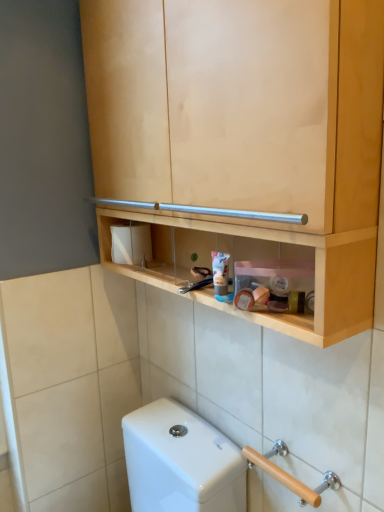
What is the approximate width of white matte toilet paper at center?

4.34 inches.

Describe the element at coordinates (220, 272) in the screenshot. The height and width of the screenshot is (512, 384). I see `white glossy toothpaste at center` at that location.

I want to click on white glossy toothpaste at center, so click(220, 272).

This screenshot has width=384, height=512. Identify the location of natural wood cabinet at upper center. (243, 137).

Locate an element on the screen. wooden at lower right is located at coordinates (289, 474).

Does point (315, 502) come farther from viewer compared to point (348, 104)?

Yes, point (315, 502) is farther from viewer.

Is wooden at lower right at the left side of natural wood cabinet at upper center?

No.

What's the angular difference between wooden at lower right and natural wood cabinet at upper center's facing directions?

The angular difference between wooden at lower right and natural wood cabinet at upper center is 0.347 degrees.

Is wooden at lower right turned away from natural wood cabinet at upper center?

No, wooden at lower right is not facing the opposite direction of natural wood cabinet at upper center.

Is wooden at lower right not close to white matte toilet paper at center?

No, wooden at lower right is not far from white matte toilet paper at center.

Where is `door handle lying in front of the white matte toilet paper at center`? door handle lying in front of the white matte toilet paper at center is located at coordinates (289, 474).

Would you say wooden at lower right is to the left or to the right of white matte toilet paper at center in the picture?

Result: Based on their positions, wooden at lower right is located to the right of white matte toilet paper at center.

How distant is wooden at lower right from white matte toilet paper at center?

wooden at lower right and white matte toilet paper at center are 24.22 inches apart from each other.

From a real-world perspective, is white matte toilet paper at center located beneath natural wood cabinet at upper center?

Yes, from a real-world perspective, white matte toilet paper at center is below natural wood cabinet at upper center.

Is white matte toilet paper at center not near natural wood cabinet at upper center?

That's not correct — white matte toilet paper at center is a little close to natural wood cabinet at upper center.

Considering the positions of point (136, 262) and point (99, 131), is point (136, 262) closer or farther from the camera than point (99, 131)?

Point (136, 262) appears to be farther away from the viewer than point (99, 131).

Between point (130, 244) and point (218, 275), which one is positioned behind?

Point (130, 244)

From the image's perspective, is white matte toilet paper at center positioned above or below white glossy toothpaste at center?

white matte toilet paper at center is situated higher than white glossy toothpaste at center in the image.

Does white matte toilet paper at center come behind white glossy toothpaste at center?

That is True.

Who is taller, white matte toilet paper at center or white glossy toothpaste at center?

white matte toilet paper at center.

Could you tell me if wooden at lower right is turned towards white glossy toothpaste at center?

No, wooden at lower right does not turn towards white glossy toothpaste at center.

Does wooden at lower right have a lesser height compared to white glossy toothpaste at center?

Indeed, wooden at lower right has a lesser height compared to white glossy toothpaste at center.

From a real-world perspective, which is physically below, wooden at lower right or white glossy toothpaste at center?

From a 3D spatial view, wooden at lower right is below.

Considering the positions of point (343, 42) and point (132, 234), is point (343, 42) closer or farther from the camera than point (132, 234)?

Point (343, 42).

What are the coordinates of `toilet paper below the natural wood cabinet at upper center (from the image's perspective)` in the screenshot? It's located at (131, 244).

Is white matte toilet paper at center located within natural wood cabinet at upper center?

Yes, white matte toilet paper at center is inside natural wood cabinet at upper center.

You are a GUI agent. You are given a task and a screenshot of the screen. Output one action in this format:
    pyautogui.click(x=<x>, y=<y>)
    Task: Click on the toothpaste below the white matte toilet paper at center (from a real-world perspective)
    
    Given the screenshot: What is the action you would take?
    pyautogui.click(x=220, y=272)

Is white glossy toothpaste at center thinner than white matte toilet paper at center?

Indeed, white glossy toothpaste at center has a lesser width compared to white matte toilet paper at center.

How many degrees apart are the facing directions of white glossy toothpaste at center and white matte toilet paper at center?

The angle between the facing direction of white glossy toothpaste at center and the facing direction of white matte toilet paper at center is 0.00278 degrees.

Where is `cabinetry located in front of the wooden at lower right`? The height and width of the screenshot is (512, 384). cabinetry located in front of the wooden at lower right is located at coordinates (243, 137).

The image size is (384, 512). I want to click on toilet paper behind the wooden at lower right, so click(131, 244).

Which object lies further to the anchor point wooden at lower right, natural wood cabinet at upper center or white glossy toothpaste at center?

natural wood cabinet at upper center is positioned further to the anchor wooden at lower right.

When comparing their distances from white matte toilet paper at center, does natural wood cabinet at upper center or wooden at lower right seem further?

wooden at lower right is further to white matte toilet paper at center.

Estimate the real-world distances between objects in this image. Which object is further from wooden at lower right, natural wood cabinet at upper center or white matte toilet paper at center?

natural wood cabinet at upper center.

In the scene shown: Estimate the real-world distances between objects in this image. Which object is closer to white matte toilet paper at center, wooden at lower right or natural wood cabinet at upper center?

The object closer to white matte toilet paper at center is natural wood cabinet at upper center.

Estimate the real-world distances between objects in this image. Which object is closer to white glossy toothpaste at center, white matte toilet paper at center or wooden at lower right?

white matte toilet paper at center lies closer to white glossy toothpaste at center than the other object.

Looking at the image, which one is located closer to white glossy toothpaste at center, wooden at lower right or natural wood cabinet at upper center?

natural wood cabinet at upper center lies closer to white glossy toothpaste at center than the other object.

Which object lies further to the anchor point wooden at lower right, white matte toilet paper at center or white glossy toothpaste at center?

The object further to wooden at lower right is white matte toilet paper at center.

Based on their spatial positions, is white glossy toothpaste at center or natural wood cabinet at upper center further from wooden at lower right?

natural wood cabinet at upper center is positioned further to the anchor wooden at lower right.

I want to click on toilet paper between natural wood cabinet at upper center and wooden at lower right in the up-down direction, so click(131, 244).

Identify the location of toothpaste between natural wood cabinet at upper center and wooden at lower right in the vertical direction. The width and height of the screenshot is (384, 512). (220, 272).

Find the location of `toothpaste between natural wood cabinet at upper center and white matte toilet paper at center from front to back`. toothpaste between natural wood cabinet at upper center and white matte toilet paper at center from front to back is located at coordinates (220, 272).

I want to click on toothpaste between white matte toilet paper at center and wooden at lower right in the up-down direction, so click(x=220, y=272).